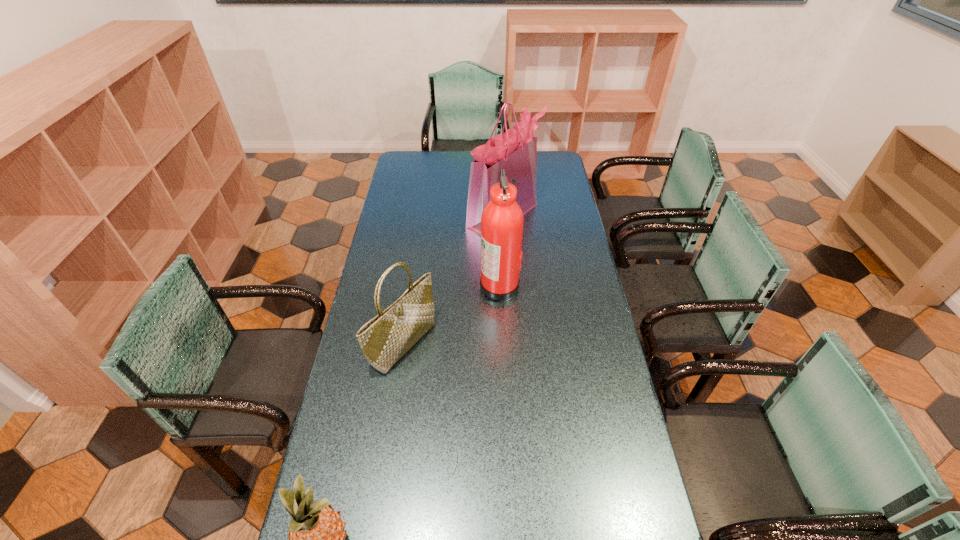
What are the coordinates of `free spot that satisfies the following two spatial constraints: 1. on the label side of the third nearest object; 2. on the front side of the nearer shopping bag` in the screenshot? It's located at (502, 344).